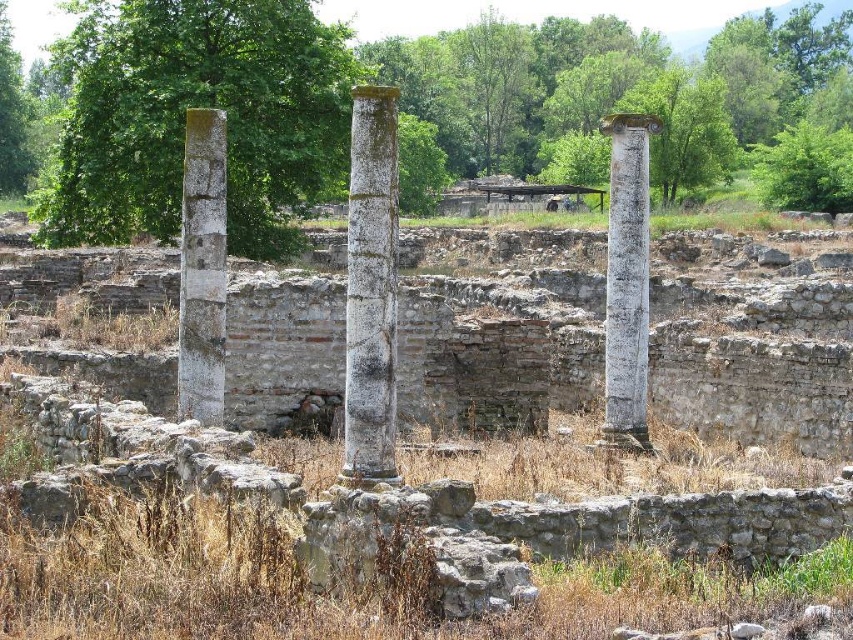
Who is more distant from viewer, (376, 280) or (183, 282)?

The point (183, 282) is behind.

You are a GUI agent. You are given a task and a screenshot of the screen. Output one action in this format:
    pyautogui.click(x=<x>, y=<y>)
    Task: Click on the white marble column at center
    
    Given the screenshot: What is the action you would take?
    pyautogui.click(x=370, y=289)

Is point (374, 401) positioned behind point (764, 198)?

No, it is not.

Does white marble column at center appear on the right side of green leafy tree at upper right?

No, white marble column at center is not to the right of green leafy tree at upper right.

You are a GUI agent. You are given a task and a screenshot of the screen. Output one action in this format:
    pyautogui.click(x=<x>, y=<y>)
    Task: Click on the white marble column at center
    
    Given the screenshot: What is the action you would take?
    pyautogui.click(x=370, y=289)

What are the coordinates of `white marble column at center` in the screenshot? It's located at (370, 289).

What do you see at coordinates (401, 106) in the screenshot?
I see `green leafy tree at upper center` at bounding box center [401, 106].

Locate an element on the screen. green leafy tree at upper center is located at coordinates (401, 106).